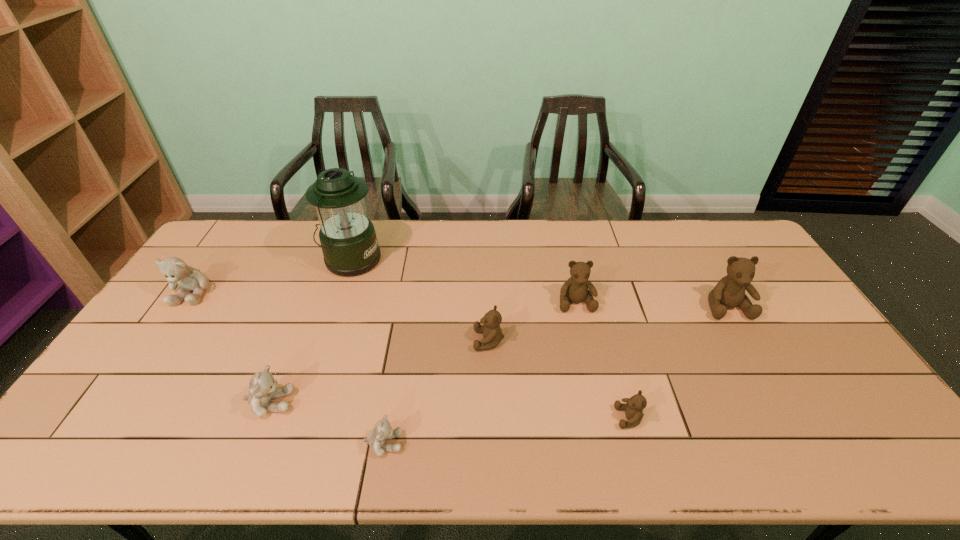
Identify which gray teddy bear is the second nearest to the smallest brown teddy bear. Please provide its 2D coordinates. Your answer should be formatted as a tuple, i.e. [(x, y)], where the tuple contains the x and y coordinates of a point satisfying the conditions above.

[(263, 388)]

At what (x,y) coordinates should I click in order to perform the action: click on vacant point that satisfies the following two spatial constraints: 1. on the front-facing side of the rightmost brown teddy bear; 2. on the face of the second teddy bear from left to right. Please return your answer as a coordinate pair (x, y). This screenshot has width=960, height=540. Looking at the image, I should click on (781, 403).

The image size is (960, 540). In order to click on vacant area that satisfies the following two spatial constraints: 1. on the front-facing side of the third smallest brown teddy bear; 2. on the face of the nearest gray teddy bear in this screenshot , I will do `click(608, 443)`.

Find the location of a particular element. This screenshot has width=960, height=540. free spot that satisfies the following two spatial constraints: 1. on the front side of the green lantern; 2. on the face of the sixth teddy bear from right to left is located at coordinates (302, 403).

The height and width of the screenshot is (540, 960). Identify the location of vacant space that satisfies the following two spatial constraints: 1. on the front-facing side of the tallest teddy bear; 2. on the face of the smallest gray teddy bear. (804, 443).

This screenshot has height=540, width=960. I want to click on vacant area in the image that satisfies the following two spatial constraints: 1. on the front-facing side of the rightmost teddy bear; 2. on the face of the second smallest gray teddy bear, so click(x=781, y=403).

At what (x,y) coordinates should I click in order to perform the action: click on vacant position in the image that satisfies the following two spatial constraints: 1. on the front-facing side of the third smallest brown teddy bear; 2. on the front-facing side of the second smallest brown teddy bear. Please return your answer as a coordinate pair (x, y). The height and width of the screenshot is (540, 960). Looking at the image, I should click on (585, 340).